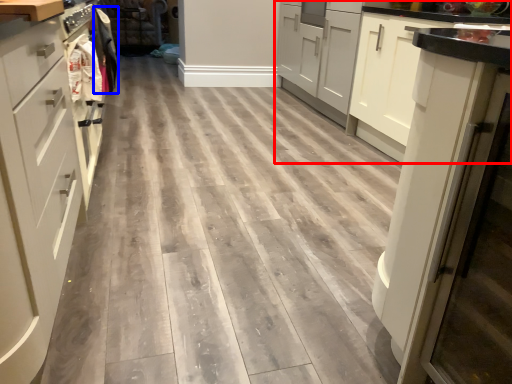
Question: Which object appears closest to the camera in this image, cabinetry (highlighted by a red box) or laundry (highlighted by a blue box)?

Choices:
 (A) cabinetry
 (B) laundry

Answer: (A)